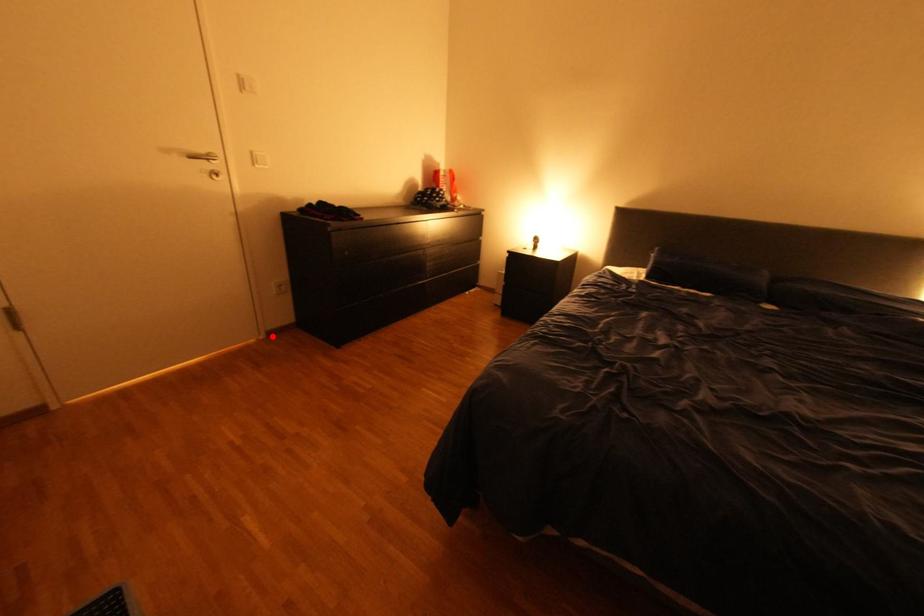
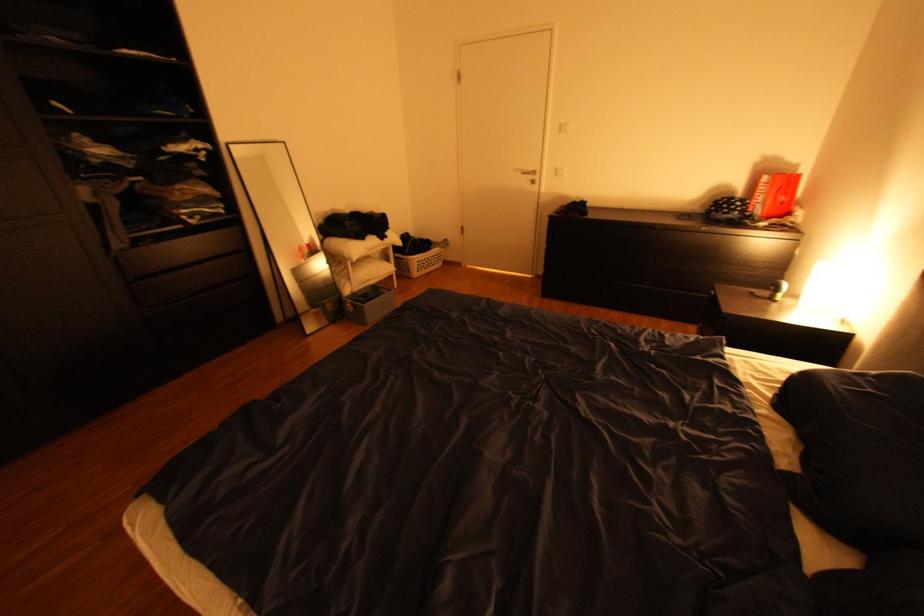
Locate, in the second image, the point that corresponds to the highlighted location in the first image.

(543, 276)